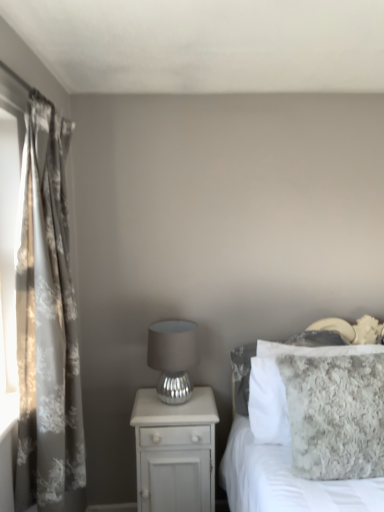
This screenshot has width=384, height=512. What are the coordinates of `free point below matte silver table lamp at center (from a real-world perspective)` in the screenshot? It's located at (173, 406).